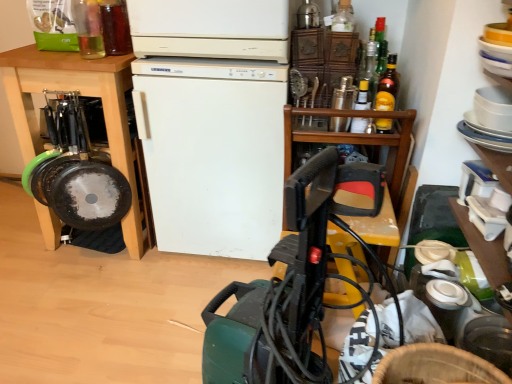
Locate an element on the screen. Image resolution: width=512 pixels, height=384 pixels. vacant space to the left of clear glass bottle at upper left, acting as the sixth bottle starting from the right is located at coordinates (53, 58).